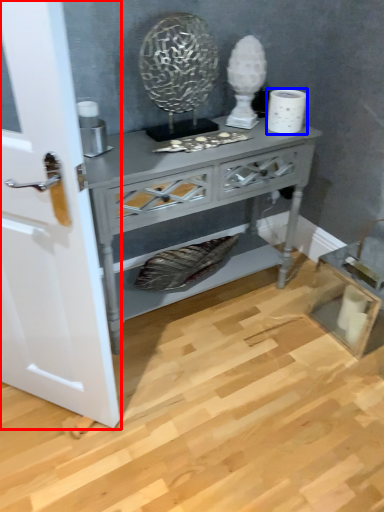
Question: Which of the following is the farthest to the observer, door (highlighted by a red box) or toilet paper (highlighted by a blue box)?

Choices:
 (A) door
 (B) toilet paper

Answer: (B)